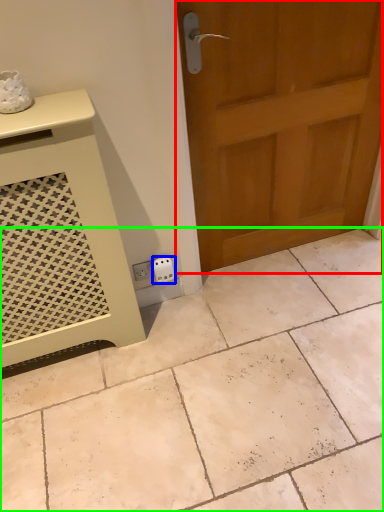
Question: Which is farther away from door (highlighted by a red box)? electric outlet (highlighted by a blue box) or ceramic tile (highlighted by a green box)?

Choices:
 (A) electric outlet
 (B) ceramic tile

Answer: (B)